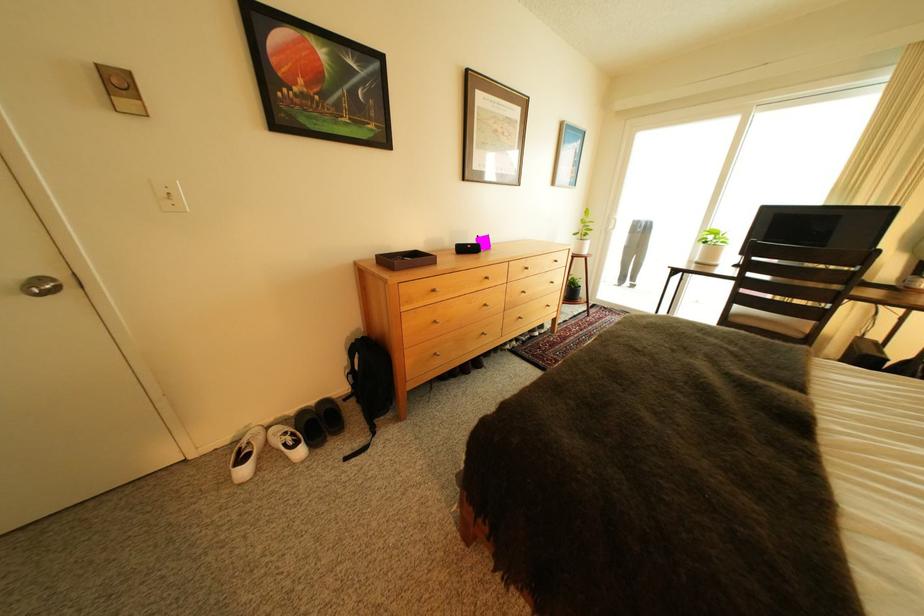
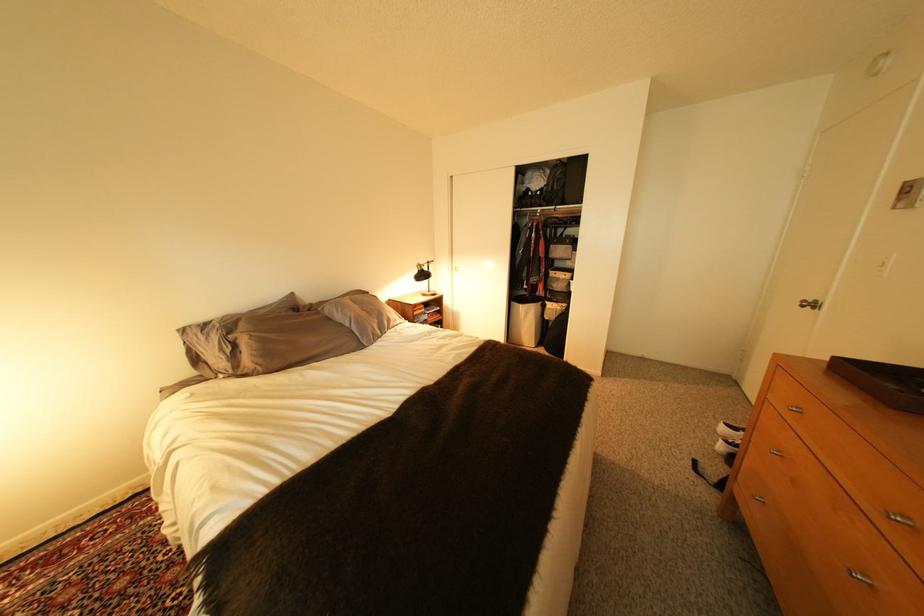
Find the pixel in the second image that matches pixel 313 454 in the first image.

(734, 448)